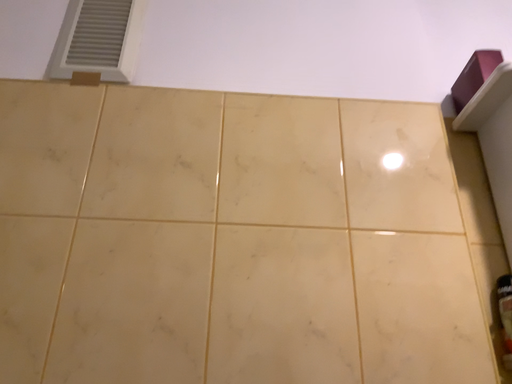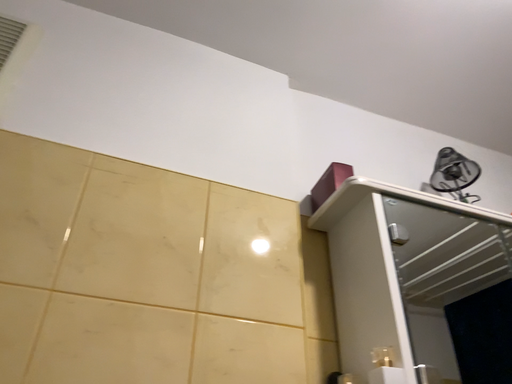
Question: Which way did the camera rotate in the video?

Choices:
 (A) rotated upward
 (B) rotated downward

Answer: (A)